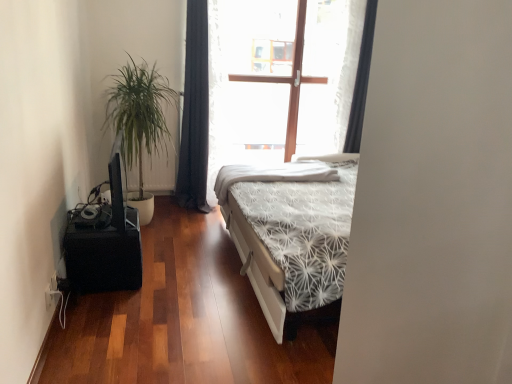
Question: From a real-world perspective, does black fabric curtain at upper right, marked as the first curtain in a right-to-left arrangement, sit lower than black matte speaker at lower left?

Choices:
 (A) yes
 (B) no

Answer: (B)

Question: Is black fabric curtain at upper right, marked as the first curtain in a right-to-left arrangement, outside black matte speaker at lower left?

Choices:
 (A) yes
 (B) no

Answer: (A)

Question: Can you confirm if black fabric curtain at upper right, marked as the first curtain in a right-to-left arrangement, is bigger than black matte speaker at lower left?

Choices:
 (A) no
 (B) yes

Answer: (A)

Question: From the image's perspective, is black fabric curtain at upper right, the second curtain viewed from the left, beneath black matte speaker at lower left?

Choices:
 (A) yes
 (B) no

Answer: (B)

Question: Is black fabric curtain at upper right, marked as the first curtain in a right-to-left arrangement, to the right of black matte speaker at lower left from the viewer's perspective?

Choices:
 (A) yes
 (B) no

Answer: (A)

Question: From a real-world perspective, is black fabric curtain at upper right, the second curtain viewed from the left, located higher than black matte speaker at lower left?

Choices:
 (A) yes
 (B) no

Answer: (A)

Question: Considering the relative sizes of black matte speaker at lower left and black fabric curtain at center, the second curtain positioned from the right, in the image provided, is black matte speaker at lower left smaller than black fabric curtain at center, the second curtain positioned from the right,?

Choices:
 (A) yes
 (B) no

Answer: (A)

Question: Does black matte speaker at lower left come in front of black fabric curtain at center, the second curtain positioned from the right?

Choices:
 (A) no
 (B) yes

Answer: (B)

Question: From the image's perspective, is black matte speaker at lower left on top of black fabric curtain at center, the second curtain positioned from the right?

Choices:
 (A) yes
 (B) no

Answer: (B)

Question: Can black fabric curtain at center, the second curtain positioned from the right, be found inside black matte speaker at lower left?

Choices:
 (A) no
 (B) yes

Answer: (A)

Question: Is black matte speaker at lower left with black fabric curtain at center, the 1th curtain from the left?

Choices:
 (A) no
 (B) yes

Answer: (A)

Question: From a real-world perspective, is black matte speaker at lower left physically above black fabric curtain at center, the second curtain positioned from the right?

Choices:
 (A) no
 (B) yes

Answer: (A)

Question: From a real-world perspective, does black matte speaker at lower left sit lower than black fabric curtain at upper right, marked as the first curtain in a right-to-left arrangement?

Choices:
 (A) no
 (B) yes

Answer: (B)